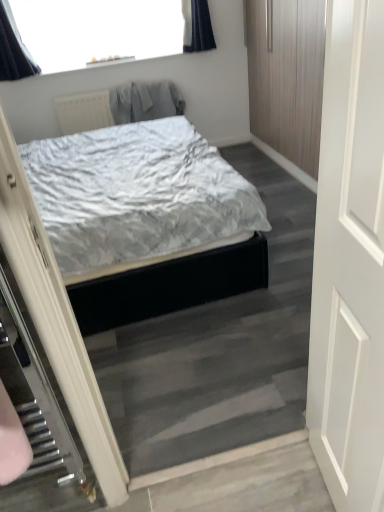
Question: From a real-world perspective, is white matte door at right physically located above or below gray fabric robe at upper center?

Choices:
 (A) above
 (B) below

Answer: (A)

Question: From the image's perspective, is white matte door at right located above or below gray fabric robe at upper center?

Choices:
 (A) above
 (B) below

Answer: (B)

Question: Considering the positions of white matte door at right and gray fabric robe at upper center in the image, is white matte door at right wider or thinner than gray fabric robe at upper center?

Choices:
 (A) wide
 (B) thin

Answer: (B)

Question: From the image's perspective, relative to white matte door at right, is gray fabric robe at upper center above or below?

Choices:
 (A) below
 (B) above

Answer: (B)

Question: Is gray fabric robe at upper center bigger or smaller than white matte door at right?

Choices:
 (A) small
 (B) big

Answer: (A)

Question: From a real-world perspective, relative to white matte door at right, is gray fabric robe at upper center vertically above or below?

Choices:
 (A) below
 (B) above

Answer: (A)

Question: Would you say gray fabric robe at upper center is to the left or to the right of white matte door at right in the picture?

Choices:
 (A) right
 (B) left

Answer: (B)